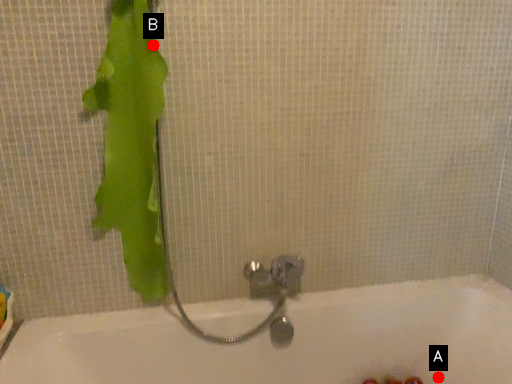
Question: Two points are circled on the image, labeled by A and B beside each circle. Which point is closer to the camera taking this photo?

Choices:
 (A) A is closer
 (B) B is closer

Answer: (B)